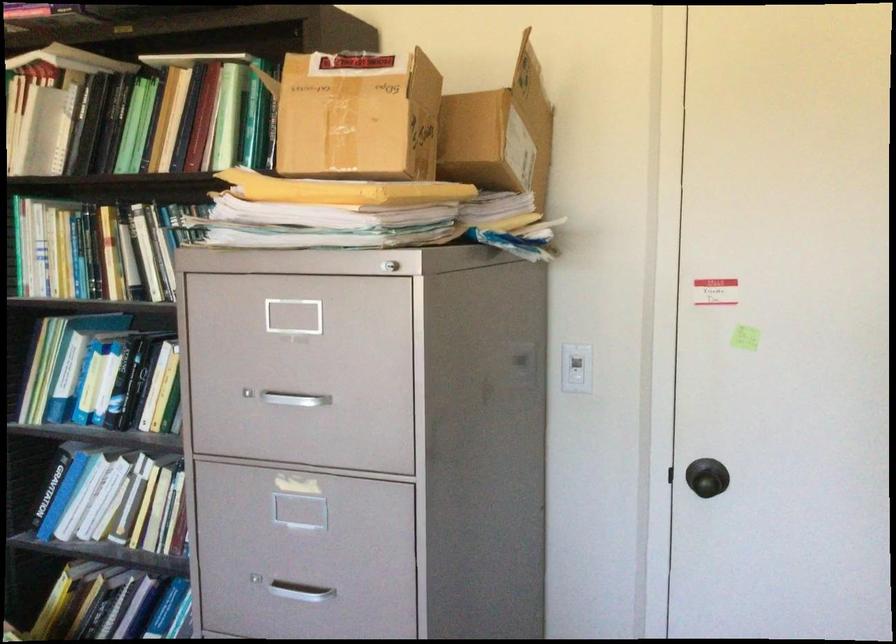
Describe the element at coordinates (575, 368) in the screenshot. The height and width of the screenshot is (644, 896). I see `the white light switch` at that location.